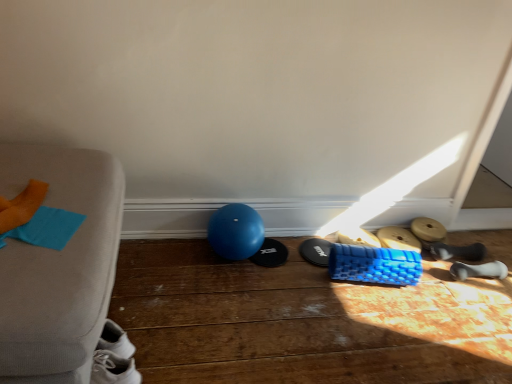
Identify the location of vacant area that is situated to the right of white rubber dumbbell at lower right, which is the 1th footwear from right to left. (501, 272).